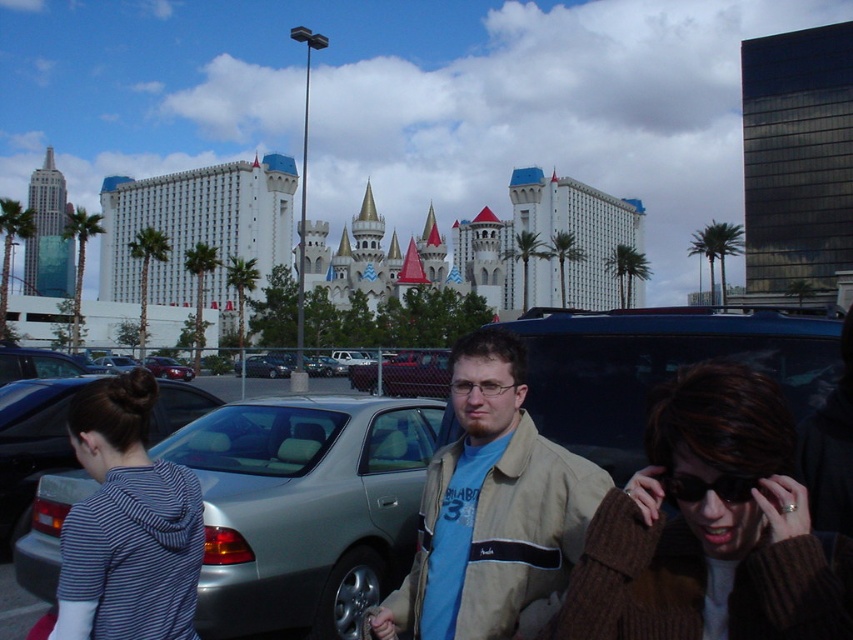
Question: Can you confirm if striped hoodie at lower left is positioned below metallic silver sedan at center?

Choices:
 (A) yes
 (B) no

Answer: (A)

Question: Which point is closer to the camera?

Choices:
 (A) (511, 557)
 (B) (706, 496)
 (C) (399, 420)

Answer: (B)

Question: Can you confirm if beige jacket at center is positioned to the left of shiny red sedan at center?

Choices:
 (A) yes
 (B) no

Answer: (B)

Question: Is metallic silver sedan at center smaller than shiny red sedan at center?

Choices:
 (A) yes
 (B) no

Answer: (A)

Question: Which is nearer to the beige jacket at center?

Choices:
 (A) brown knitted sweater at lower right
 (B) silver metallic car at center
 (C) striped hoodie at lower left
 (D) metallic silver car at center

Answer: (D)

Question: Which object is the closest to the metallic silver sedan at center?

Choices:
 (A) striped hoodie at lower left
 (B) brown knitted sweater at lower right

Answer: (A)